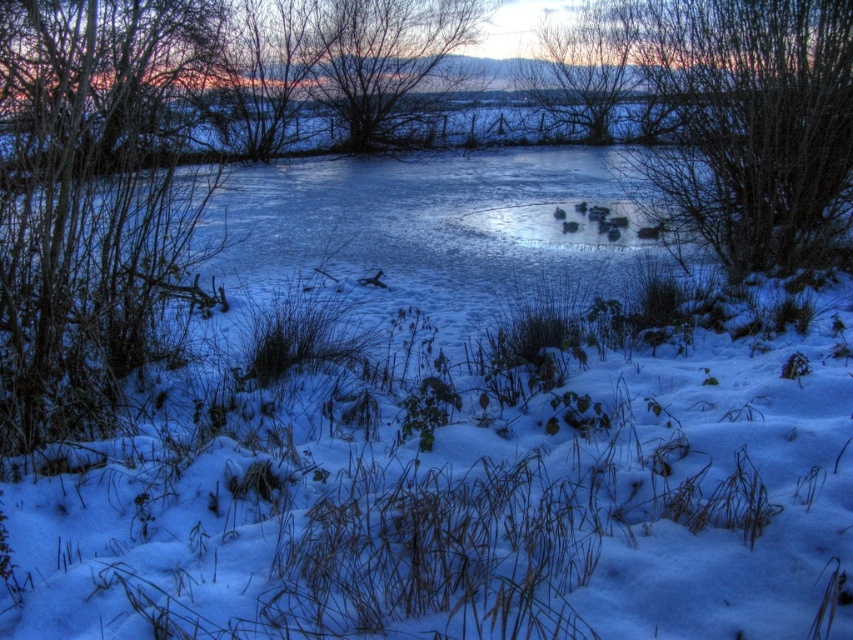
You are standing at the edge of the pond and want to place two markers on the ice. The first marker is at point (61, 38) and the second is at point (451, 26). Which marker will be closer to your current position?

The marker at point (61, 38) will be closer to your current position because it is closer to the viewer than point (451, 26).

You are an ornithologist observing ducks in the partially frozen pond. You notice the smooth bark tree at left and the bare branches at upper right in the background. Which of these two objects is located to the left of the other?

The smooth bark tree at left is positioned on the left side of bare branches at upper right.

You are an ornithologist observing the ducks in the pond. You notice the smooth bark tree at left and the bare branches at upper right. Which object is bigger in size?

The smooth bark tree at left has a larger size compared to the bare branches at upper right.